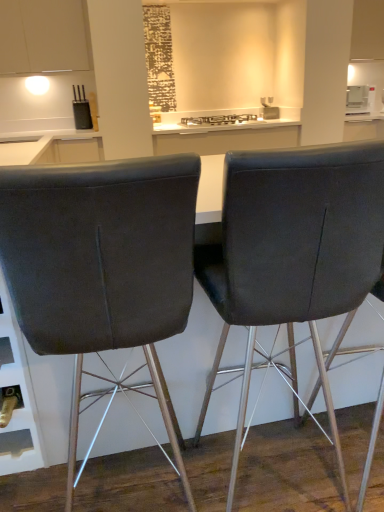
Where is `metallic silver gas stove at center`? The height and width of the screenshot is (512, 384). metallic silver gas stove at center is located at coordinates (219, 120).

I want to click on matte black chair at center, placed as the 2th chair when sorted from left to right, so click(294, 253).

How much space does dark gray fabric chair at center, which is the 1th chair in left-to-right order, occupy horizontally?

dark gray fabric chair at center, which is the 1th chair in left-to-right order, is 21.12 inches wide.

The height and width of the screenshot is (512, 384). I want to click on metallic silver gas stove at center, so click(219, 120).

Is white glossy microwave at upper right inside the boundaries of matte black chair at center, the 1th chair from the right, or outside?

white glossy microwave at upper right lies outside matte black chair at center, the 1th chair from the right.

From the picture: Can you confirm if white glossy microwave at upper right is smaller than matte black chair at center, the 1th chair from the right?

Yes.

Is white glossy microwave at upper right at the left side of matte black chair at center, placed as the 2th chair when sorted from left to right?

In fact, white glossy microwave at upper right is to the right of matte black chair at center, placed as the 2th chair when sorted from left to right.

Considering the relative sizes of white glossy microwave at upper right and metallic silver gas stove at center in the image provided, is white glossy microwave at upper right thinner than metallic silver gas stove at center?

Correct, the width of white glossy microwave at upper right is less than that of metallic silver gas stove at center.

Does white glossy microwave at upper right have a lesser height compared to metallic silver gas stove at center?

No.

Is white glossy microwave at upper right facing towards metallic silver gas stove at center?

No, white glossy microwave at upper right is not oriented towards metallic silver gas stove at center.

Identify the location of appliance above the metallic silver gas stove at center (from the image's perspective). The height and width of the screenshot is (512, 384). (360, 99).

Is dark gray fabric chair at center, which is counted as the 2th chair, starting from the right, oriented towards white glossy microwave at upper right?

No, dark gray fabric chair at center, which is counted as the 2th chair, starting from the right, is not oriented towards white glossy microwave at upper right.

From the image's perspective, between dark gray fabric chair at center, which is counted as the 2th chair, starting from the right, and white glossy microwave at upper right, who is located below?

From the image's view, dark gray fabric chair at center, which is counted as the 2th chair, starting from the right, is below.

From a real-world perspective, which object rests below the other?

In real-world perspective, dark gray fabric chair at center, which is the 1th chair in left-to-right order, is lower.

Considering the sizes of dark gray fabric chair at center, which is counted as the 2th chair, starting from the right, and white glossy microwave at upper right in the image, is dark gray fabric chair at center, which is counted as the 2th chair, starting from the right, wider or thinner than white glossy microwave at upper right?

In the image, dark gray fabric chair at center, which is counted as the 2th chair, starting from the right, appears to be wider than white glossy microwave at upper right.

Is matte black chair at center, placed as the 2th chair when sorted from left to right, behind metallic silver gas stove at center?

No, it is not.

Which is nearer, (382, 161) or (212, 116)?

The point (382, 161) is in front.

Is matte black chair at center, placed as the 2th chair when sorted from left to right, positioned far away from metallic silver gas stove at center?

Yes.

Considering the sizes of objects matte black chair at center, the 1th chair from the right, and metallic silver gas stove at center in the image provided, who is smaller, matte black chair at center, the 1th chair from the right, or metallic silver gas stove at center?

metallic silver gas stove at center is smaller.

Is white glossy microwave at upper right behind white matte cabinet at upper left?

Yes.

From the image's perspective, is white glossy microwave at upper right located beneath white matte cabinet at upper left?

Yes, from the image's perspective, white glossy microwave at upper right is beneath white matte cabinet at upper left.

Are white glossy microwave at upper right and white matte cabinet at upper left far apart?

white glossy microwave at upper right is positioned a significant distance from white matte cabinet at upper left.

From the image's perspective, is white matte cabinet at upper left over matte black chair at center, placed as the 2th chair when sorted from left to right?

Indeed, from the image's perspective, white matte cabinet at upper left is shown above matte black chair at center, placed as the 2th chair when sorted from left to right.

Can you confirm if white matte cabinet at upper left is thinner than matte black chair at center, the 1th chair from the right?

Yes.

Is white matte cabinet at upper left touching matte black chair at center, placed as the 2th chair when sorted from left to right?

No, white matte cabinet at upper left is not in contact with matte black chair at center, placed as the 2th chair when sorted from left to right.

Is white matte cabinet at upper left oriented away from matte black chair at center, the 1th chair from the right?

No.

Could you tell me if metallic silver gas stove at center is facing white glossy microwave at upper right?

No, metallic silver gas stove at center is not oriented towards white glossy microwave at upper right.

Does metallic silver gas stove at center contain white glossy microwave at upper right?

That's incorrect, white glossy microwave at upper right is not inside metallic silver gas stove at center.

From the picture: Does metallic silver gas stove at center touch white glossy microwave at upper right?

No, metallic silver gas stove at center is not with white glossy microwave at upper right.

Considering the sizes of objects metallic silver gas stove at center and white glossy microwave at upper right in the image provided, who is shorter, metallic silver gas stove at center or white glossy microwave at upper right?

metallic silver gas stove at center.

Starting from the white glossy microwave at upper right, which chair is the 1st one in front? Please provide its 2D coordinates.

[(294, 253)]

Where is `gas stove located on the left of white glossy microwave at upper right`? gas stove located on the left of white glossy microwave at upper right is located at coordinates (219, 120).

When comparing their distances from matte black chair at center, the 1th chair from the right, does white glossy microwave at upper right or white matte cabinet at upper left seem further?

The object further to matte black chair at center, the 1th chair from the right, is white glossy microwave at upper right.

Which object lies nearer to the anchor point matte black chair at center, placed as the 2th chair when sorted from left to right, metallic silver gas stove at center or white matte cabinet at upper left?

metallic silver gas stove at center is closer to matte black chair at center, placed as the 2th chair when sorted from left to right.

Estimate the real-world distances between objects in this image. Which object is further from metallic silver gas stove at center, matte black chair at center, placed as the 2th chair when sorted from left to right, or white glossy microwave at upper right?

The object further to metallic silver gas stove at center is matte black chair at center, placed as the 2th chair when sorted from left to right.

Looking at the image, which one is located further to metallic silver gas stove at center, white glossy microwave at upper right or matte black chair at center, the 1th chair from the right?

The object further to metallic silver gas stove at center is matte black chair at center, the 1th chair from the right.

From the image, which object appears to be farther from white glossy microwave at upper right, metallic silver gas stove at center or white matte cabinet at upper left?

white matte cabinet at upper left.

From the picture: Which object lies further to the anchor point metallic silver gas stove at center, white glossy microwave at upper right or dark gray fabric chair at center, which is counted as the 2th chair, starting from the right?

dark gray fabric chair at center, which is counted as the 2th chair, starting from the right, is positioned further to the anchor metallic silver gas stove at center.

Which object lies further to the anchor point metallic silver gas stove at center, dark gray fabric chair at center, which is counted as the 2th chair, starting from the right, or white glossy microwave at upper right?

Based on the image, dark gray fabric chair at center, which is counted as the 2th chair, starting from the right, appears to be further to metallic silver gas stove at center.

When comparing their distances from dark gray fabric chair at center, which is the 1th chair in left-to-right order, does matte black chair at center, placed as the 2th chair when sorted from left to right, or white glossy microwave at upper right seem further?

white glossy microwave at upper right.

At what (x,y) coordinates should I click in order to perform the action: click on cabinetry between matte black chair at center, the 1th chair from the right, and white glossy microwave at upper right in the front-back direction. Please return your answer as a coordinate pair (x, y). Looking at the image, I should click on (42, 36).

At what (x,y) coordinates should I click in order to perform the action: click on cabinetry located between dark gray fabric chair at center, which is the 1th chair in left-to-right order, and white glossy microwave at upper right in the depth direction. Please return your answer as a coordinate pair (x, y). Image resolution: width=384 pixels, height=512 pixels. Looking at the image, I should click on (42, 36).

You are a GUI agent. You are given a task and a screenshot of the screen. Output one action in this format:
    pyautogui.click(x=<x>, y=<y>)
    Task: Click on the cabinetry between dark gray fabric chair at center, which is counted as the 2th chair, starting from the right, and metallic silver gas stove at center, along the z-axis
    
    Given the screenshot: What is the action you would take?
    pyautogui.click(x=42, y=36)

In order to click on cabinetry between matte black chair at center, the 1th chair from the right, and metallic silver gas stove at center, along the z-axis in this screenshot , I will do `click(42, 36)`.